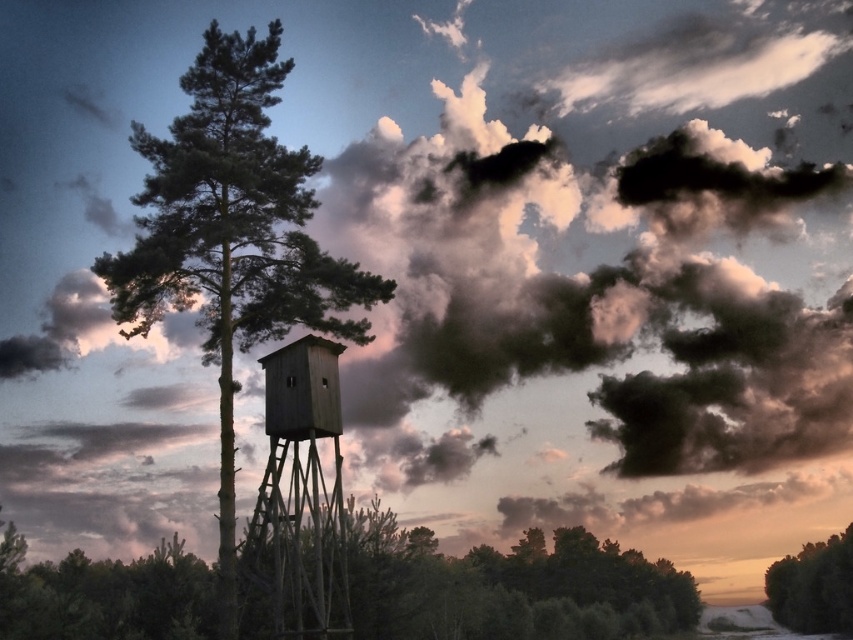
You are planning to hang a bird feeder between the green matte tree at center and the green matte tree at lower right. Which tree should you choose if you want the feeder to be closer to the center of the image?

The green matte tree at center is already positioned at the center of the image, so hanging the bird feeder there would place it closer to the center compared to the green matte tree at lower right.